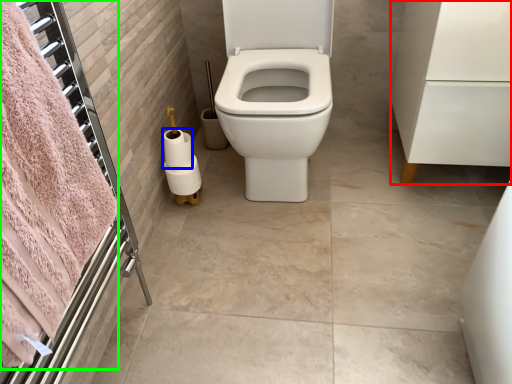
Question: Estimate the real-world distances between objects in this image. Which object is closer to porcelain (highlighted by a red box), toilet paper (highlighted by a blue box) or bath towel (highlighted by a green box)?

Choices:
 (A) toilet paper
 (B) bath towel

Answer: (A)